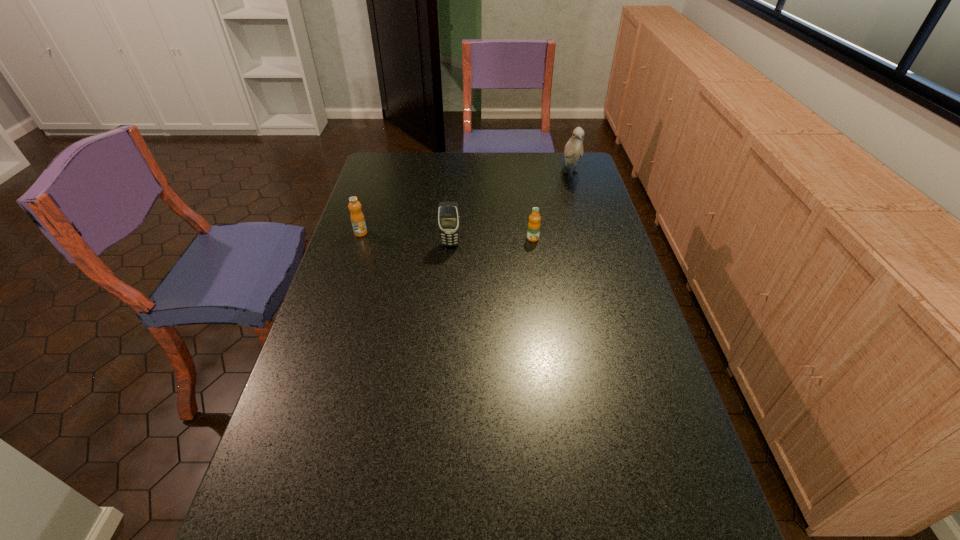
Where is `free location located 0.110m on the label of the right orange juice`? The image size is (960, 540). free location located 0.110m on the label of the right orange juice is located at coordinates (537, 264).

You are a GUI agent. You are given a task and a screenshot of the screen. Output one action in this format:
    pyautogui.click(x=<x>, y=<y>)
    Task: Click on the object that is positioned at the far edge
    The image size is (960, 540).
    Given the screenshot: What is the action you would take?
    pyautogui.click(x=573, y=151)

Locate an element on the screen. This screenshot has height=540, width=960. object at the left edge is located at coordinates (357, 218).

Locate an element on the screen. object at the right edge is located at coordinates (573, 151).

I want to click on object that is at the far right corner, so click(x=573, y=151).

This screenshot has width=960, height=540. What are the coordinates of `free location at the far edge` in the screenshot? It's located at (469, 164).

This screenshot has height=540, width=960. I want to click on free space at the left edge of the desktop, so click(x=337, y=297).

In the image, there is a desktop. Identify the location of vacant space at the right edge. The image size is (960, 540). (603, 354).

The image size is (960, 540). Identify the location of unoccupied area between the shortest object and the second object from left to right. (492, 241).

I want to click on empty space between the third shortest object and the second object from right to left, so click(x=492, y=241).